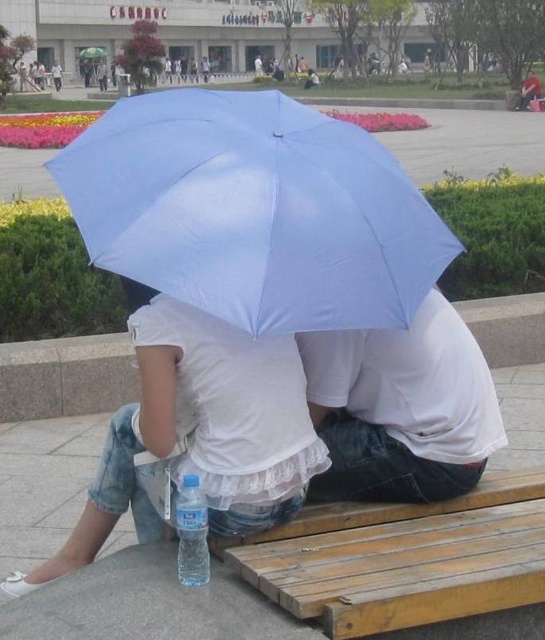
Question: Is light blue fabric umbrella at center smaller than clear plastic bottle at lower center?

Choices:
 (A) no
 (B) yes

Answer: (A)

Question: Based on their relative distances, which object is nearer to the wooden bench at lower center?

Choices:
 (A) white matte shirt at center
 (B) clear plastic bottle at lower center

Answer: (A)

Question: Can you confirm if white matte umbrella at center is positioned below white matte shirt at center?

Choices:
 (A) yes
 (B) no

Answer: (A)

Question: Is light blue fabric umbrella at center wider than wooden bench at lower center?

Choices:
 (A) no
 (B) yes

Answer: (B)

Question: Which is farther from the light blue fabric umbrella at center?

Choices:
 (A) wooden bench at lower center
 (B) clear plastic bottle at lower center
 (C) white matte umbrella at center
 (D) white matte shirt at center

Answer: (A)

Question: Which point appears closest to the camera in this image?

Choices:
 (A) (439, 339)
 (B) (464, 522)
 (C) (199, 566)
 (D) (320, 417)

Answer: (C)